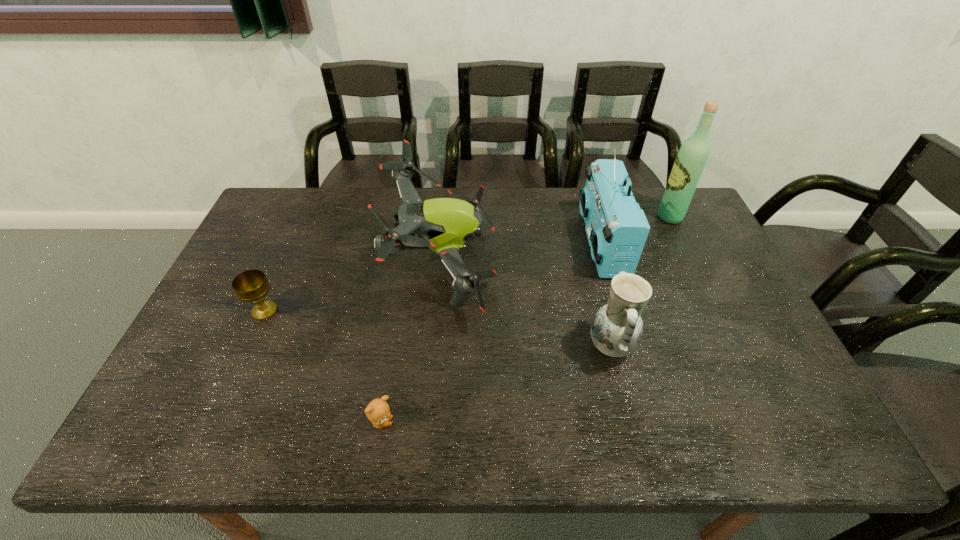
At what (x,y) coordinates should I click in order to perform the action: click on vacant space situated on the face of the shortest object. Please return your answer as a coordinate pair (x, y). The height and width of the screenshot is (540, 960). Looking at the image, I should click on (446, 422).

The height and width of the screenshot is (540, 960). Identify the location of wine bottle that is positioned at the far edge. (692, 157).

Where is `drone situated at the far edge`? drone situated at the far edge is located at coordinates (444, 225).

Where is `radio receiver situated at the far edge`? This screenshot has width=960, height=540. radio receiver situated at the far edge is located at coordinates click(617, 229).

Find the location of a particular element. This screenshot has height=540, width=960. object that is at the near edge is located at coordinates (378, 412).

Image resolution: width=960 pixels, height=540 pixels. Identify the location of object that is positioned at the left edge. pyautogui.click(x=250, y=286).

Locate an element on the screen. This screenshot has width=960, height=540. object at the right edge is located at coordinates (692, 157).

Identify the location of object present at the far right corner. (692, 157).

I want to click on free space at the far edge of the desktop, so click(341, 219).

Identify the location of vacant position at the near edge of the desktop. (512, 450).